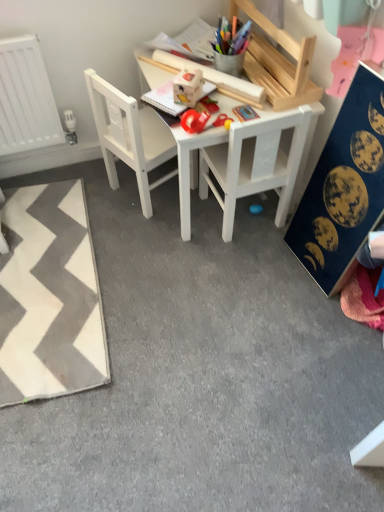
Where is `white wooden table at center`? The height and width of the screenshot is (512, 384). white wooden table at center is located at coordinates (191, 168).

Considering the positions of objects dark blue fabric with celestial prints at right and white matte chair at center, which is the first chair in right-to-left order, in the image provided, who is behind, dark blue fabric with celestial prints at right or white matte chair at center, which is the first chair in right-to-left order,?

white matte chair at center, which is the first chair in right-to-left order.

Does point (338, 117) lie behind point (221, 150)?

No, it is not.

Is dark blue fabric with celestial prints at right situated inside white matte chair at center, placed as the second chair when sorted from left to right, or outside?

dark blue fabric with celestial prints at right is located beyond the bounds of white matte chair at center, placed as the second chair when sorted from left to right.

Is dark blue fabric with celestial prints at right facing away from white wooden table at center?

→ No, dark blue fabric with celestial prints at right's orientation is not away from white wooden table at center.

Considering the sizes of dark blue fabric with celestial prints at right and white wooden table at center in the image, is dark blue fabric with celestial prints at right bigger or smaller than white wooden table at center?

Considering their sizes, dark blue fabric with celestial prints at right takes up less space than white wooden table at center.

Is point (310, 239) closer or farther from the camera than point (189, 220)?

Clearly, point (310, 239) is closer to the camera than point (189, 220).

Is white matte chair at center, the second chair from the right, thinner than white wooden table at center?

Yes, white matte chair at center, the second chair from the right, is thinner than white wooden table at center.

Relative to white wooden table at center, is white matte chair at center, which ranks as the 1th chair in left-to-right order, in front or behind?

Visually, white matte chair at center, which ranks as the 1th chair in left-to-right order, is located behind white wooden table at center.

From a real-world perspective, is white matte chair at center, which ranks as the 1th chair in left-to-right order, physically located above or below white wooden table at center?

white matte chair at center, which ranks as the 1th chair in left-to-right order, is situated higher than white wooden table at center in the real world.

Is white matte chair at center, the second chair from the right, inside or outside of white wooden table at center?

white matte chair at center, the second chair from the right, lies within the bounds of white wooden table at center.

Can you confirm if white matte chair at center, which ranks as the 1th chair in left-to-right order, is smaller than white zigzag rug at lower left?

Incorrect, white matte chair at center, which ranks as the 1th chair in left-to-right order, is not smaller in size than white zigzag rug at lower left.

Locate an element on the screen. The width and height of the screenshot is (384, 512). the 2nd chair above the white zigzag rug at lower left (from a real-world perspective) is located at coordinates (130, 136).

Which is correct: white matte chair at center, which ranks as the 1th chair in left-to-right order, is inside white zigzag rug at lower left, or outside of it?

white matte chair at center, which ranks as the 1th chair in left-to-right order, is not inside white zigzag rug at lower left, it's outside.

Considering the sizes of objects white matte chair at center, the second chair from the right, and white zigzag rug at lower left in the image provided, who is thinner, white matte chair at center, the second chair from the right, or white zigzag rug at lower left?

white matte chair at center, the second chair from the right.

Is point (251, 101) positioned in front of point (218, 153)?

Yes, point (251, 101) is closer to viewer.

Is white wooden table at center bigger than white matte chair at center, which is the first chair in right-to-left order?

Yes, white wooden table at center is bigger than white matte chair at center, which is the first chair in right-to-left order.

Is white matte chair at center, placed as the second chair when sorted from left to right, surrounded by white wooden table at center?

Yes, white matte chair at center, placed as the second chair when sorted from left to right, is surrounded by white wooden table at center.

This screenshot has height=512, width=384. I want to click on mat below the dark blue fabric with celestial prints at right (from a real-world perspective), so click(x=50, y=297).

Is dark blue fabric with celestial prints at right turned away from white zigzag rug at lower left?

No, dark blue fabric with celestial prints at right's orientation is not away from white zigzag rug at lower left.

Is dark blue fabric with celestial prints at right beside white zigzag rug at lower left?

No, dark blue fabric with celestial prints at right is not in contact with white zigzag rug at lower left.

Considering the relative sizes of dark blue fabric with celestial prints at right and white zigzag rug at lower left in the image provided, is dark blue fabric with celestial prints at right smaller than white zigzag rug at lower left?

Actually, dark blue fabric with celestial prints at right might be larger than white zigzag rug at lower left.

How different are the orientations of white zigzag rug at lower left and white matte chair at center, which is the first chair in right-to-left order, in degrees?

The angle between the facing direction of white zigzag rug at lower left and the facing direction of white matte chair at center, which is the first chair in right-to-left order, is 6.71 degrees.

Based on the photo, from a real-world perspective, is white zigzag rug at lower left below white matte chair at center, placed as the second chair when sorted from left to right?

Yes, from a real-world perspective, white zigzag rug at lower left is beneath white matte chair at center, placed as the second chair when sorted from left to right.

Is white zigzag rug at lower left surrounding white matte chair at center, which is the first chair in right-to-left order?

Definitely not — white matte chair at center, which is the first chair in right-to-left order, is not inside white zigzag rug at lower left.

Is white zigzag rug at lower left next to white matte chair at center, which is the first chair in right-to-left order, and touching it?

No, white zigzag rug at lower left is not beside white matte chair at center, which is the first chair in right-to-left order.

This screenshot has height=512, width=384. In order to click on the 1st chair to the left of the dark blue fabric with celestial prints at right, starting your count from the anchor in this screenshot , I will do `click(255, 163)`.

At what (x,y) coordinates should I click in order to perform the action: click on table behind the dark blue fabric with celestial prints at right. Please return your answer as a coordinate pair (x, y). Looking at the image, I should click on (191, 168).

Estimate the real-world distances between objects in this image. Which object is closer to white matte chair at center, which ranks as the 1th chair in left-to-right order, white wooden table at center or white zigzag rug at lower left?

white wooden table at center is positioned closer to the anchor white matte chair at center, which ranks as the 1th chair in left-to-right order.

Based on their spatial positions, is white matte chair at center, which is the first chair in right-to-left order, or white matte chair at center, the second chair from the right, closer to dark blue fabric with celestial prints at right?

The object closer to dark blue fabric with celestial prints at right is white matte chair at center, which is the first chair in right-to-left order.

Which object lies further to the anchor point white matte chair at center, which ranks as the 1th chair in left-to-right order, dark blue fabric with celestial prints at right or white wooden table at center?

Based on the image, dark blue fabric with celestial prints at right appears to be further to white matte chair at center, which ranks as the 1th chair in left-to-right order.

From the image, which object appears to be farther from white zigzag rug at lower left, dark blue fabric with celestial prints at right or white matte chair at center, which is the first chair in right-to-left order?

Based on the image, dark blue fabric with celestial prints at right appears to be further to white zigzag rug at lower left.

Based on their spatial positions, is white wooden table at center or white matte chair at center, which is the first chair in right-to-left order, closer to white matte chair at center, which ranks as the 1th chair in left-to-right order?

Among the two, white wooden table at center is located nearer to white matte chair at center, which ranks as the 1th chair in left-to-right order.

From the image, which object appears to be nearer to white wooden table at center, white matte chair at center, the second chair from the right, or dark blue fabric with celestial prints at right?

white matte chair at center, the second chair from the right.

When comparing their distances from dark blue fabric with celestial prints at right, does white matte chair at center, placed as the second chair when sorted from left to right, or white zigzag rug at lower left seem further?

white zigzag rug at lower left.

From the image, which object appears to be nearer to white wooden table at center, white zigzag rug at lower left or white matte chair at center, which ranks as the 1th chair in left-to-right order?

white matte chair at center, which ranks as the 1th chair in left-to-right order, is positioned closer to the anchor white wooden table at center.

The width and height of the screenshot is (384, 512). Identify the location of table between white zigzag rug at lower left and dark blue fabric with celestial prints at right from left to right. (191, 168).

Find the location of a particular element. The height and width of the screenshot is (512, 384). table between white matte chair at center, which ranks as the 1th chair in left-to-right order, and dark blue fabric with celestial prints at right from left to right is located at coordinates (191, 168).

Image resolution: width=384 pixels, height=512 pixels. I want to click on table situated between white matte chair at center, which ranks as the 1th chair in left-to-right order, and white matte chair at center, placed as the second chair when sorted from left to right, from left to right, so click(191, 168).

Find the location of a particular element. The height and width of the screenshot is (512, 384). chair situated between white zigzag rug at lower left and white matte chair at center, placed as the second chair when sorted from left to right, from left to right is located at coordinates (130, 136).